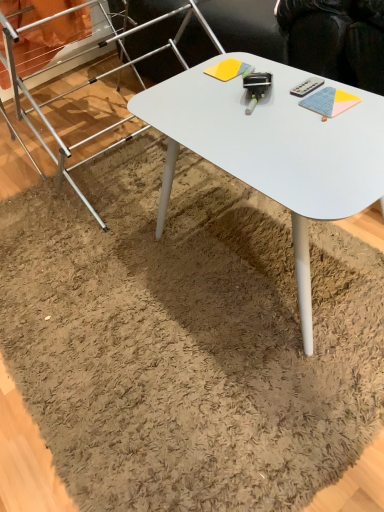
Where is `free space in front of yellow matte notepad at center, marked as the first notepad in a top-to-bottom arrangement`? free space in front of yellow matte notepad at center, marked as the first notepad in a top-to-bottom arrangement is located at coordinates (237, 97).